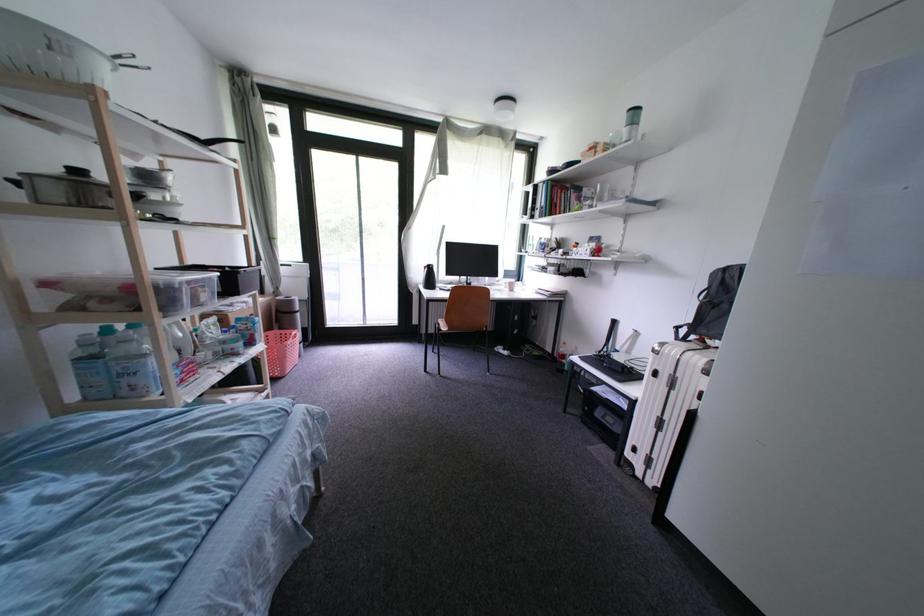
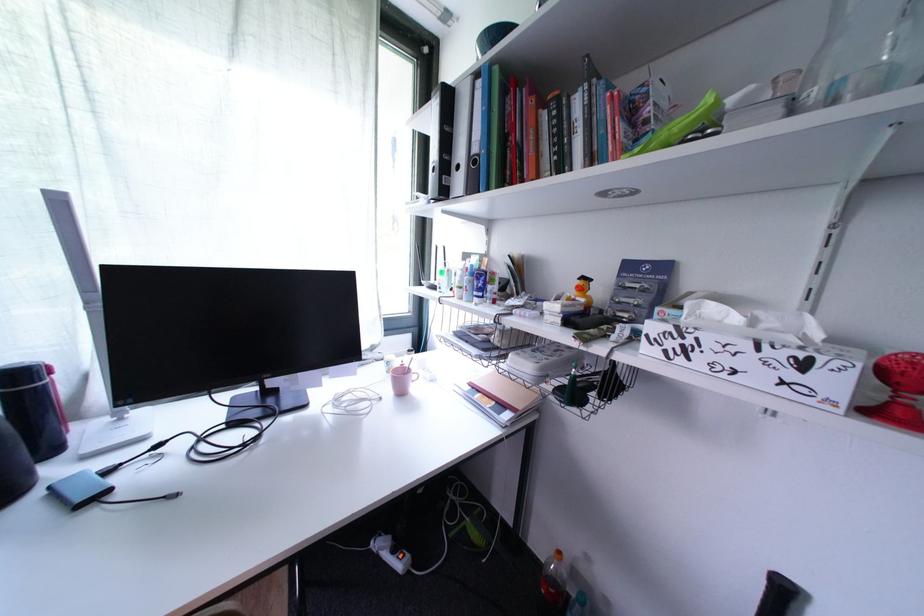
Question: The images are taken continuously from a first-person perspective. In which direction are you moving?

Choices:
 (A) Left
 (B) Right
 (C) Forward
 (D) Backward

Answer: (C)